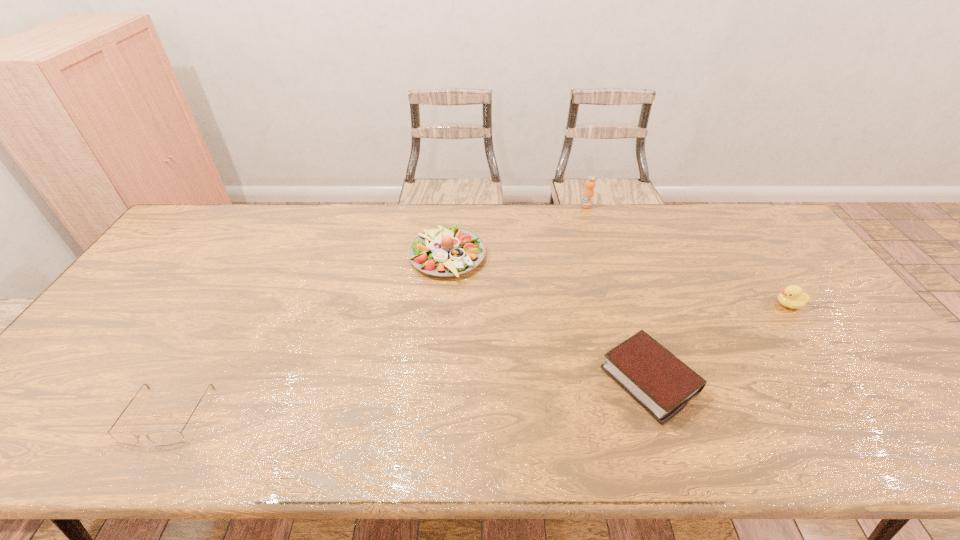
In the image, there is a desktop. Where is `free space at the near edge`? The height and width of the screenshot is (540, 960). free space at the near edge is located at coordinates (207, 429).

At what (x,y) coordinates should I click in order to perform the action: click on vacant space at the left edge of the desktop. Please return your answer as a coordinate pair (x, y). Image resolution: width=960 pixels, height=540 pixels. Looking at the image, I should click on (156, 299).

Where is `vacant space at the right edge of the desktop`? The image size is (960, 540). vacant space at the right edge of the desktop is located at coordinates (765, 271).

This screenshot has height=540, width=960. I want to click on vacant position at the far left corner of the desktop, so click(212, 234).

Locate an element on the screen. The height and width of the screenshot is (540, 960). free area in between the leftmost object and the duckling is located at coordinates (477, 360).

The width and height of the screenshot is (960, 540). I want to click on vacant space that's between the spectacles and the farthest object, so click(376, 310).

Locate an element on the screen. free area in between the orange juice and the fourth nearest object is located at coordinates (516, 231).

Identify the location of free area in between the second object from left to right and the leftmost object. (306, 336).

Locate an element on the screen. free space that is in between the salad plate and the duckling is located at coordinates (618, 280).

At what (x,y) coordinates should I click in order to perform the action: click on free space between the rightmost object and the Bible. Please return your answer as a coordinate pair (x, y). This screenshot has width=960, height=540. Looking at the image, I should click on pos(719,342).